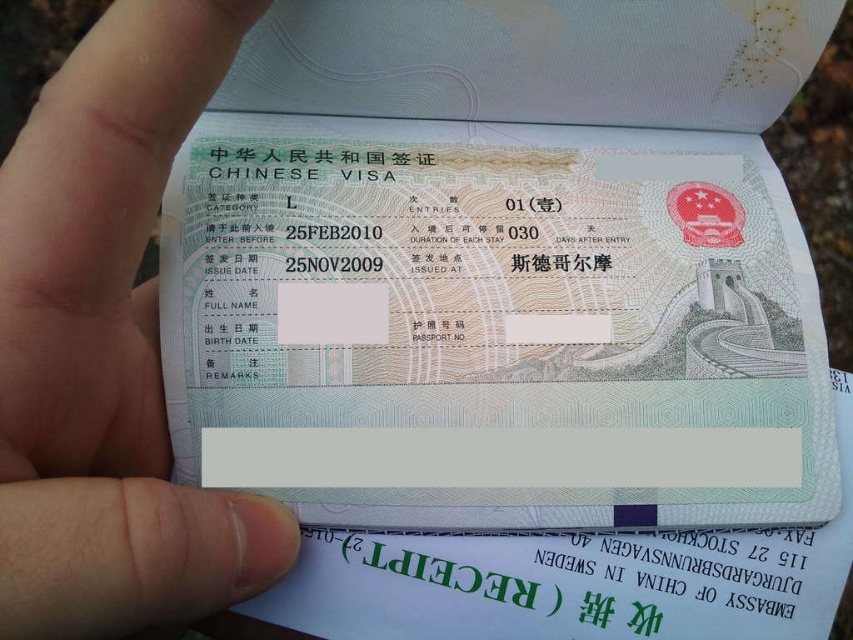
You are a travel agent helping a client with their visa documents. You notice two pieces of paper in the image. One is the light green paper visa at center, and the other is the white matte paper at lower left. Which of these two papers is wider?

The light green paper visa at center is wider than the white matte paper at lower left according to the description.